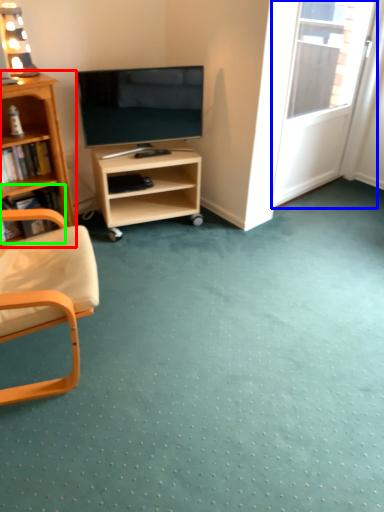
Question: Which object is positioned closest to bookcase (highlighted by a red box)? Select from screen door (highlighted by a blue box) and book (highlighted by a green box).

Choices:
 (A) screen door
 (B) book

Answer: (B)